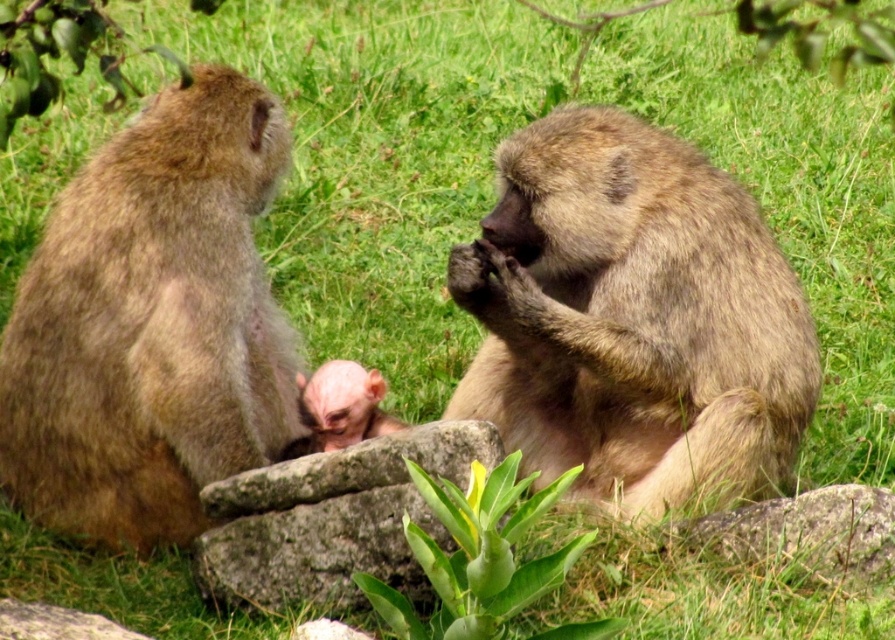
Question: Which point is farther to the camera?

Choices:
 (A) brown furry monkey at left
 (B) pink fur baby monkey at center
 (C) brown furry monkey at center
 (D) gray stone at center

Answer: (C)

Question: Which object is positioned farthest from the gray stone at center?

Choices:
 (A) brown furry monkey at center
 (B) pink fur baby monkey at center

Answer: (A)

Question: Does gray stone at center have a larger size compared to pink fur baby monkey at center?

Choices:
 (A) yes
 (B) no

Answer: (A)

Question: Can you confirm if brown furry monkey at left is positioned above gray stone at center?

Choices:
 (A) yes
 (B) no

Answer: (A)

Question: Can you confirm if brown furry monkey at center is positioned to the left of brown furry monkey at left?

Choices:
 (A) no
 (B) yes

Answer: (A)

Question: Based on their relative distances, which object is farther from the gray stone at center?

Choices:
 (A) brown furry monkey at left
 (B) brown furry monkey at center
 (C) pink fur baby monkey at center

Answer: (B)